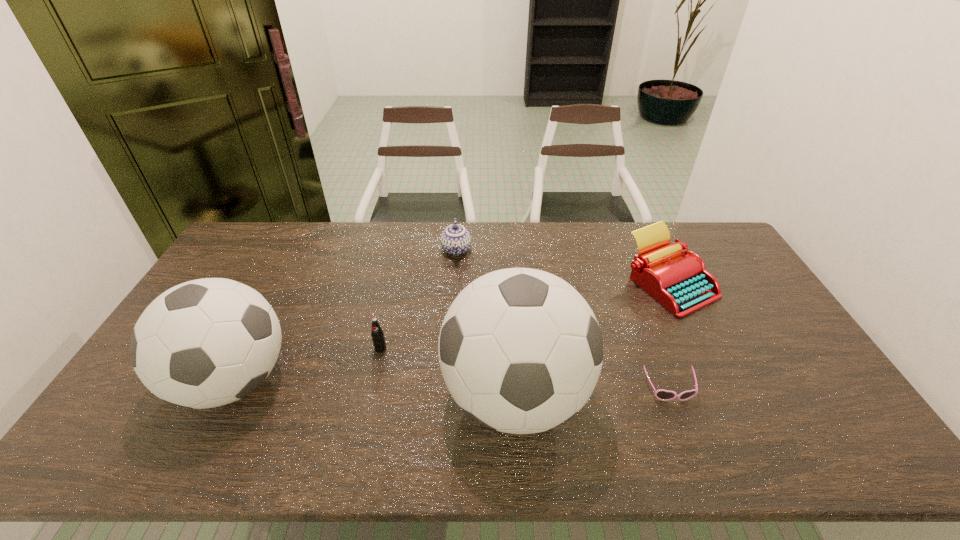
You are a GUI agent. You are given a task and a screenshot of the screen. Output one action in this format:
    pyautogui.click(x=<x>, y=<y>)
    Task: Click on the free point that keeps the soccer balls evenly spaced on the right
    The width and height of the screenshot is (960, 540).
    Given the screenshot: What is the action you would take?
    pyautogui.click(x=814, y=412)